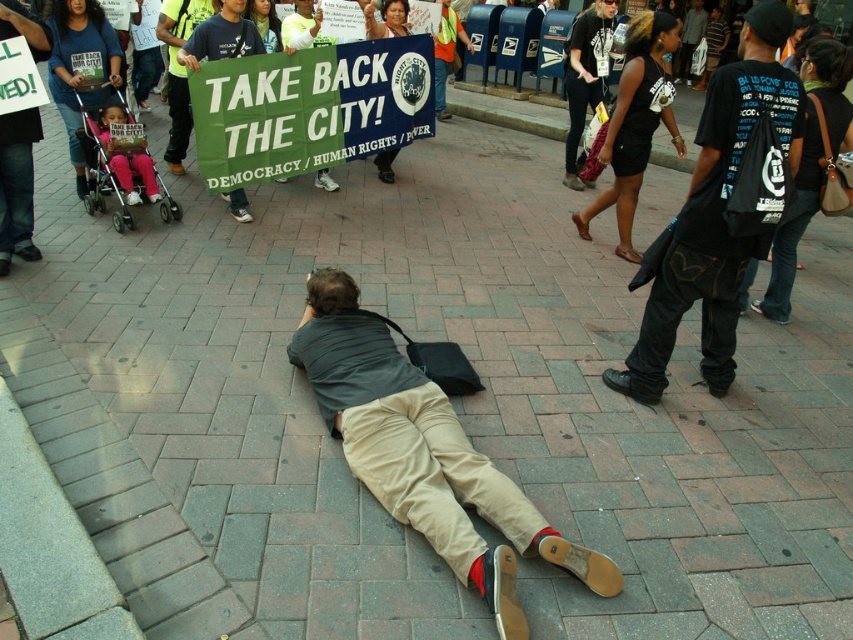
Question: Is khaki cotton pants at center to the right of black cotton t-shirt at center from the viewer's perspective?

Choices:
 (A) yes
 (B) no

Answer: (B)

Question: Which point is closer to the camera?

Choices:
 (A) black cotton t-shirt at center
 (B) khaki cotton pants at center

Answer: (B)

Question: Among these objects, which one is farthest from the camera?

Choices:
 (A) khaki cotton pants at center
 (B) black cotton t-shirt at center

Answer: (B)

Question: Does khaki cotton pants at center have a smaller size compared to black cotton t-shirt at center?

Choices:
 (A) yes
 (B) no

Answer: (B)

Question: Which object appears closest to the camera in this image?

Choices:
 (A) khaki cotton pants at center
 (B) black cotton t-shirt at center

Answer: (A)

Question: Does khaki cotton pants at center have a lesser width compared to black cotton t-shirt at center?

Choices:
 (A) yes
 (B) no

Answer: (B)